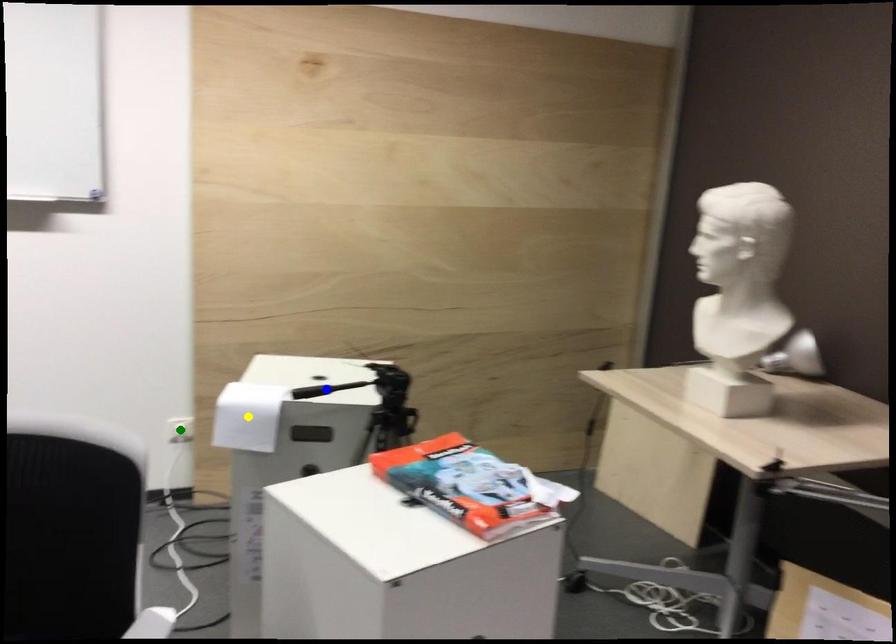
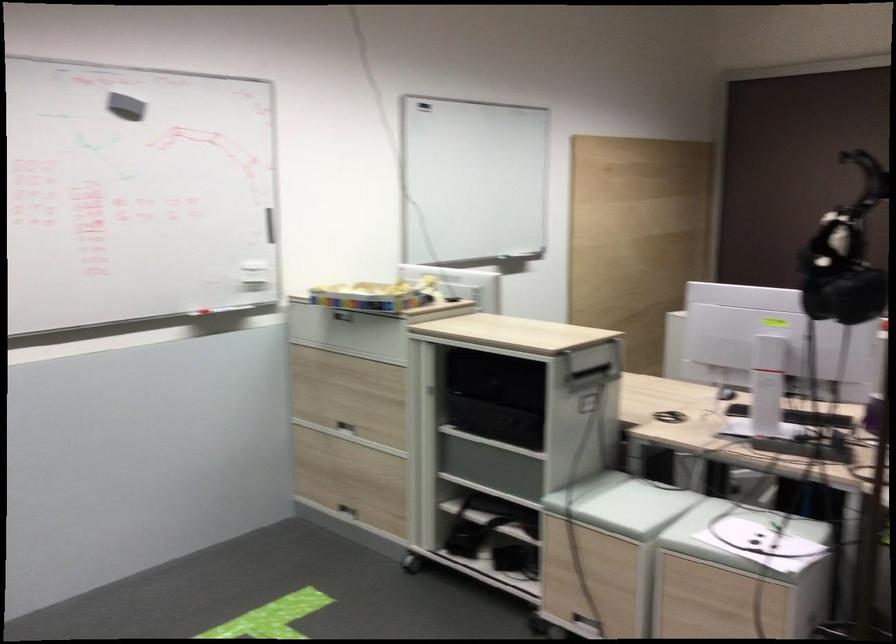
I am providing you with two images of the same scene from different viewpoints. Three points are marked in image1. Which point corresponds to a part or object that is occluded in image2?In image1, three points are marked. Which of them correspond to a part or object that is occluded in image2?Among the three points shown in image1, which one corresponds to a part or object that is no longer visible due to occlusion in image2?

Invisible in image2: blue point, yellow point, green point.